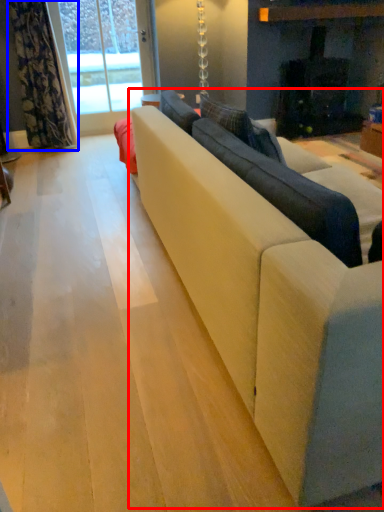
Question: Which object is further to the camera taking this photo, studio couch (highlighted by a red box) or curtain (highlighted by a blue box)?

Choices:
 (A) studio couch
 (B) curtain

Answer: (B)